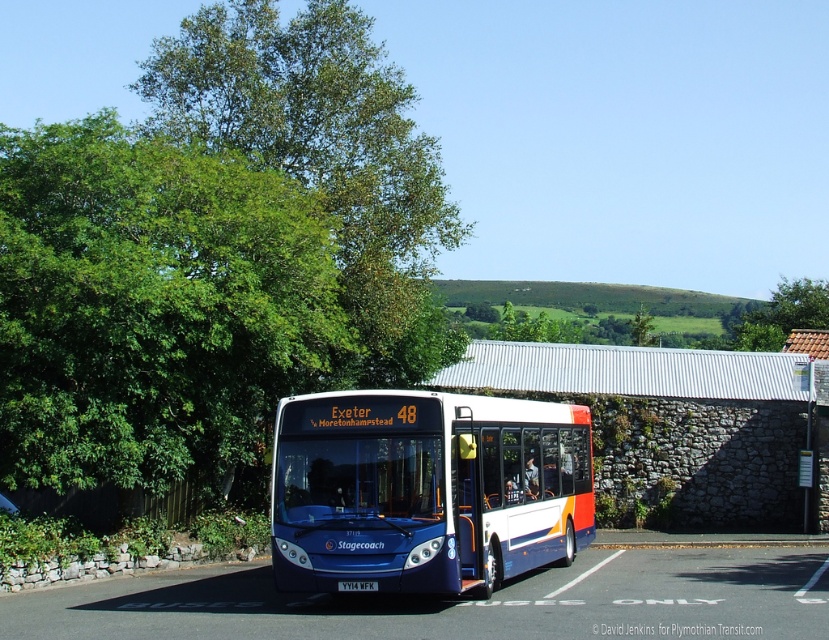
Question: Which object is closer to the camera taking this photo?

Choices:
 (A) blue metallic bus at center
 (B) green leafy tree at left
 (C) green leafy tree at upper left

Answer: (A)

Question: Which of the following is the farthest from the observer?

Choices:
 (A) green leafy tree at left
 (B) blue metallic bus at center
 (C) green leafy tree at upper left

Answer: (C)

Question: Is green leafy tree at upper left positioned at the back of blue metallic bus at center?

Choices:
 (A) no
 (B) yes

Answer: (B)

Question: Observing the image, what is the correct spatial positioning of green leafy tree at left in reference to green leafy tree at upper left?

Choices:
 (A) right
 (B) left

Answer: (B)

Question: Which of the following is the farthest from the observer?

Choices:
 (A) (449, 586)
 (B) (437, 326)

Answer: (B)

Question: Does green leafy tree at left appear on the left side of green leafy tree at upper left?

Choices:
 (A) yes
 (B) no

Answer: (A)